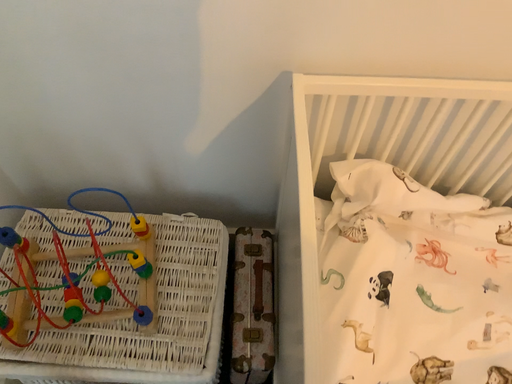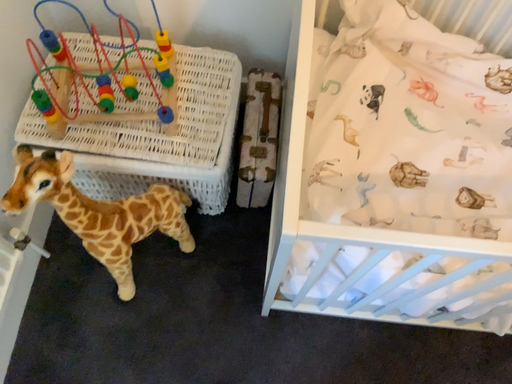
Question: How did the camera likely rotate when shooting the video?

Choices:
 (A) rotated upward
 (B) rotated downward

Answer: (B)